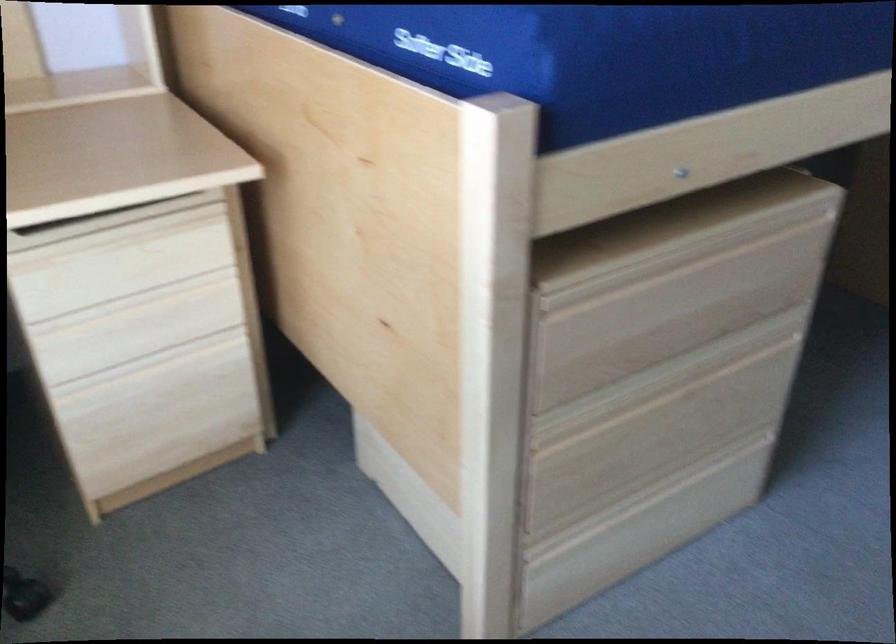
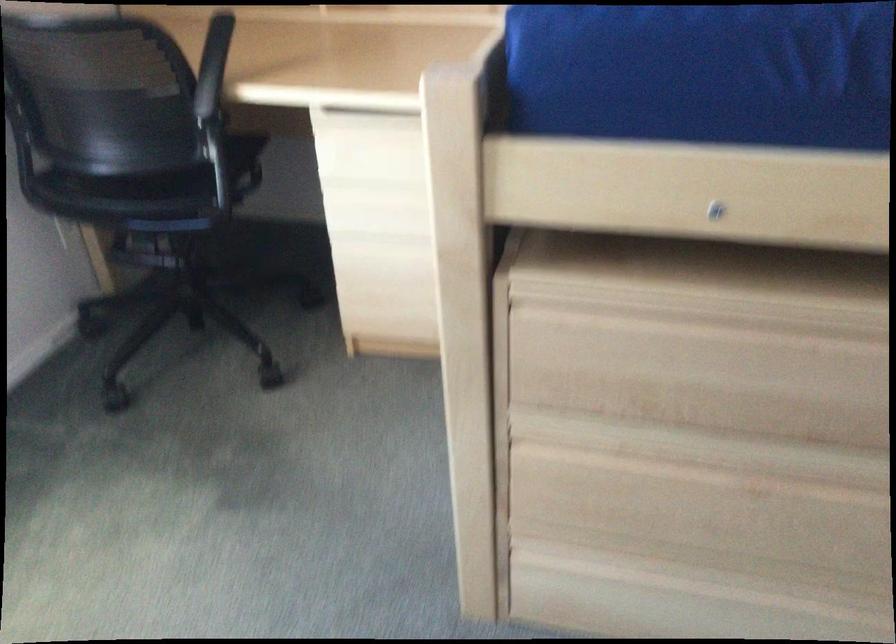
Where in the second image is the point corresponding to point (648, 491) from the first image?

(705, 582)